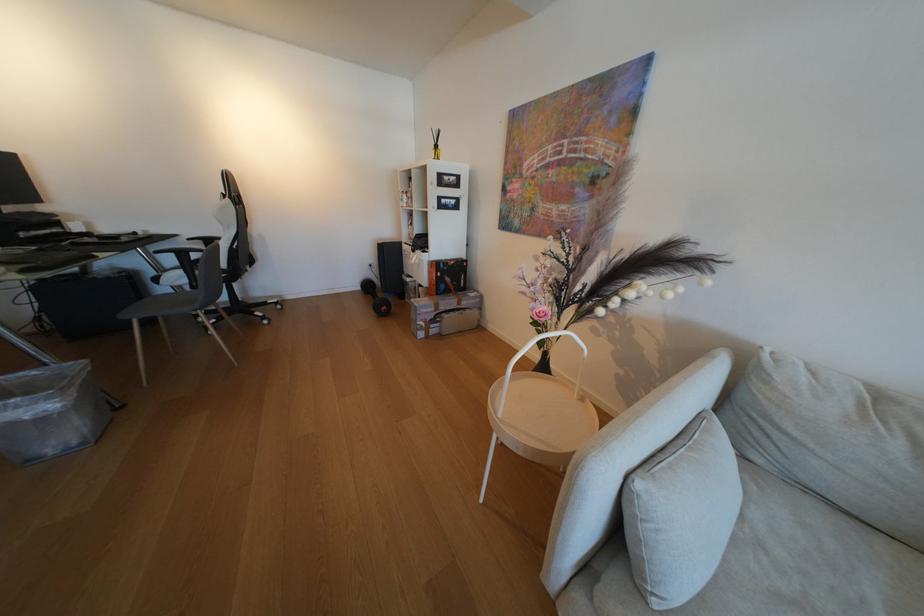
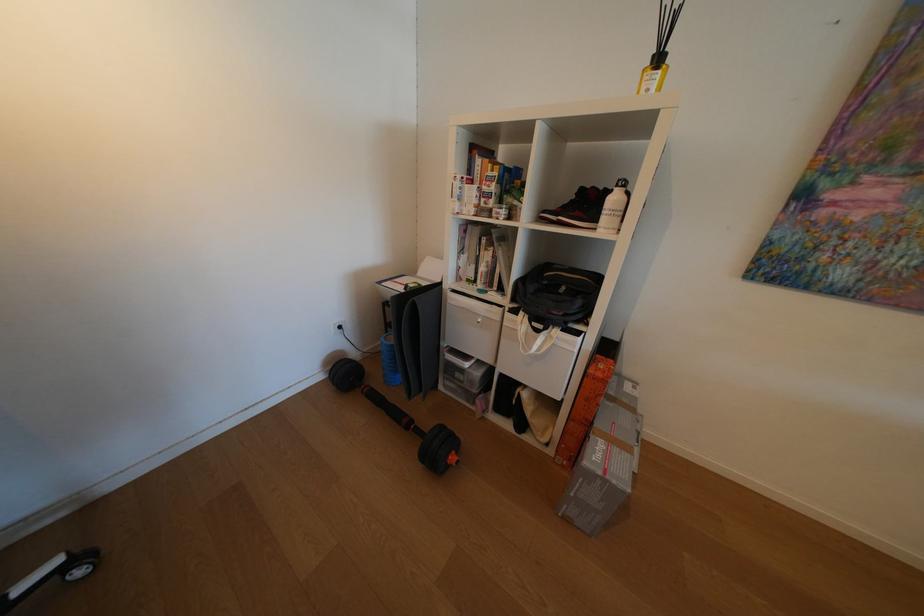
Where in the second image is the point corresponding to point (427, 305) from the first image?

(626, 483)